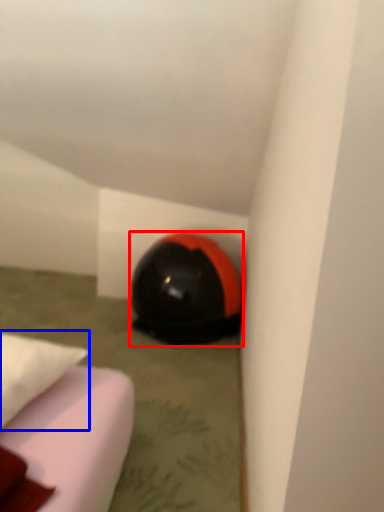
Question: Which object appears closest to the camera in this image, helmet (highlighted by a red box) or pillow (highlighted by a blue box)?

Choices:
 (A) helmet
 (B) pillow

Answer: (B)